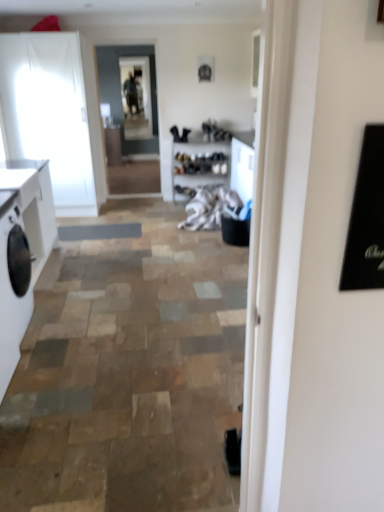
Question: Does clear glass door at center have a lesser width compared to white fabric at center?

Choices:
 (A) no
 (B) yes

Answer: (B)

Question: Considering the relative positions of clear glass door at center and white fabric at center in the image provided, is clear glass door at center to the right of white fabric at center from the viewer's perspective?

Choices:
 (A) no
 (B) yes

Answer: (A)

Question: Is clear glass door at center surrounding white fabric at center?

Choices:
 (A) yes
 (B) no

Answer: (B)

Question: Does clear glass door at center appear on the left side of white fabric at center?

Choices:
 (A) yes
 (B) no

Answer: (A)

Question: Is clear glass door at center aimed at white fabric at center?

Choices:
 (A) no
 (B) yes

Answer: (A)

Question: Is white matte cabinet at left, acting as the first cabinetry starting from the bottom, wider or thinner than clear glass window screen at center?

Choices:
 (A) wide
 (B) thin

Answer: (A)

Question: Which is correct: white matte cabinet at left, the second cabinetry when ordered from back to front, is inside clear glass window screen at center, or outside of it?

Choices:
 (A) outside
 (B) inside

Answer: (A)

Question: From a real-world perspective, is white matte cabinet at left, marked as the first cabinetry in a front-to-back arrangement, positioned above or below clear glass window screen at center?

Choices:
 (A) above
 (B) below

Answer: (B)

Question: Relative to clear glass window screen at center, is white matte cabinet at left, acting as the second cabinetry starting from the top, in front or behind?

Choices:
 (A) behind
 (B) front

Answer: (B)

Question: Based on their positions, is white matte washing machine at left located to the left or right of clear glass window screen at center?

Choices:
 (A) right
 (B) left

Answer: (B)

Question: From the image's perspective, is white matte washing machine at left above or below clear glass window screen at center?

Choices:
 (A) above
 (B) below

Answer: (B)

Question: Considering the positions of white matte washing machine at left and clear glass window screen at center in the image, is white matte washing machine at left taller or shorter than clear glass window screen at center?

Choices:
 (A) tall
 (B) short

Answer: (B)

Question: Looking at their shapes, would you say white matte washing machine at left is wider or thinner than clear glass window screen at center?

Choices:
 (A) thin
 (B) wide

Answer: (B)

Question: Is point (82, 143) closer or farther from the camera than point (16, 203)?

Choices:
 (A) closer
 (B) farther

Answer: (B)

Question: Is white glossy cabinet at left, which appears as the second cabinetry when ordered from the bottom, in front of or behind white matte washing machine at left in the image?

Choices:
 (A) behind
 (B) front

Answer: (A)